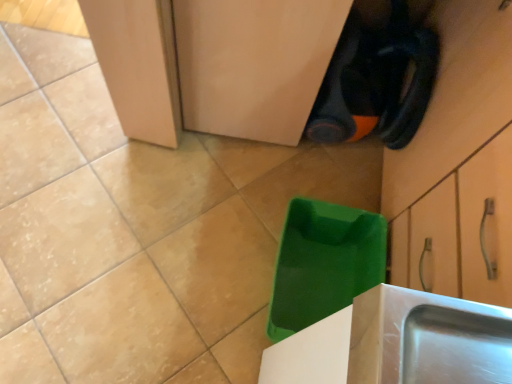
Where is `matte wood cabinet at upper right`? matte wood cabinet at upper right is located at coordinates (458, 163).

The image size is (512, 384). What do you see at coordinates (458, 163) in the screenshot? I see `matte wood cabinet at upper right` at bounding box center [458, 163].

The width and height of the screenshot is (512, 384). I want to click on matte wood cabinet at upper right, so click(458, 163).